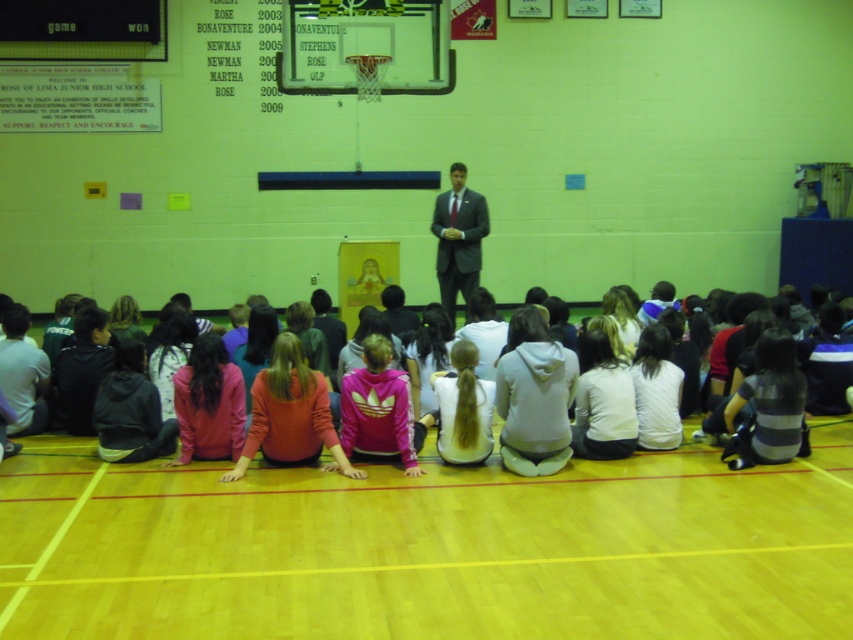
Question: Which object is the closest to the white hoodie at center?

Choices:
 (A) solid white jersey at center
 (B) matte gray suit at center

Answer: (A)

Question: Does solid white jersey at center appear on the left side of matte gray suit at center?

Choices:
 (A) yes
 (B) no

Answer: (A)

Question: Which of the following is the farthest from the observer?

Choices:
 (A) (467, 195)
 (B) (477, 355)

Answer: (A)

Question: Is solid white jersey at center behind matte gray suit at center?

Choices:
 (A) yes
 (B) no

Answer: (B)

Question: Which object is positioned farthest from the white hoodie at center?

Choices:
 (A) solid white jersey at center
 (B) matte gray suit at center

Answer: (B)

Question: Considering the relative positions of solid white jersey at center and white hoodie at center in the image provided, where is solid white jersey at center located with respect to white hoodie at center?

Choices:
 (A) right
 (B) left

Answer: (B)